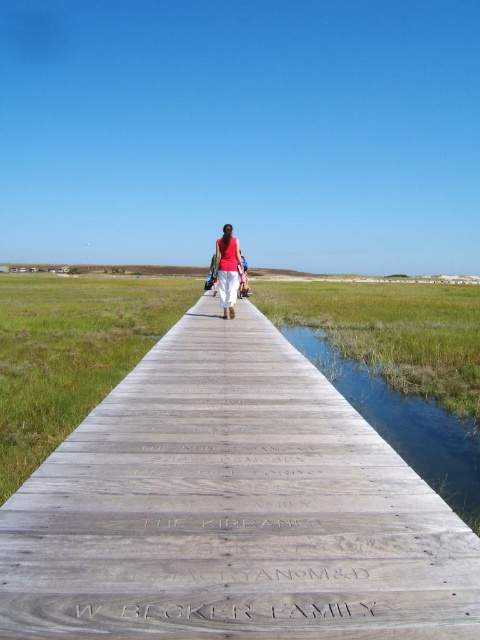
Based on the photo, does wooden at center appear under green grassy salt marsh at center?

No.

You are a GUI agent. You are given a task and a screenshot of the screen. Output one action in this format:
    pyautogui.click(x=<x>, y=<y>)
    Task: Click on the wooden at center
    This screenshot has height=640, width=480.
    Given the screenshot: What is the action you would take?
    pyautogui.click(x=231, y=509)

Who is positioned more to the left, green grassy salt marsh at center or matte red shirt at center?

matte red shirt at center is more to the left.

Is green grassy salt marsh at center to the right of matte red shirt at center from the viewer's perspective?

Correct, you'll find green grassy salt marsh at center to the right of matte red shirt at center.

The width and height of the screenshot is (480, 640). Find the location of `green grassy salt marsh at center`. green grassy salt marsh at center is located at coordinates (405, 422).

Who is more distant from viewer, (x=295, y=504) or (x=227, y=285)?

The point (x=227, y=285) is behind.

This screenshot has height=640, width=480. Describe the element at coordinates (231, 509) in the screenshot. I see `wooden at center` at that location.

What do you see at coordinates (231, 509) in the screenshot?
I see `wooden at center` at bounding box center [231, 509].

I want to click on wooden at center, so click(x=231, y=509).